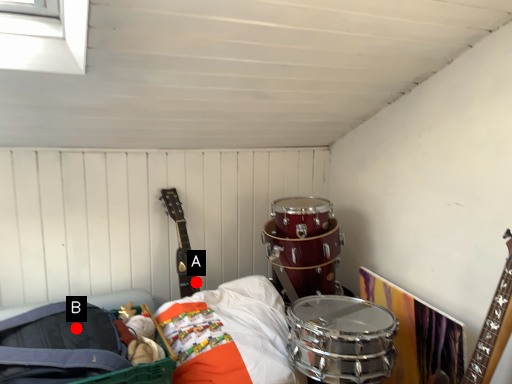
Question: Two points are circled on the image, labeled by A and B beside each circle. Among these points, which one is nearest to the camera?

Choices:
 (A) A is closer
 (B) B is closer

Answer: (B)